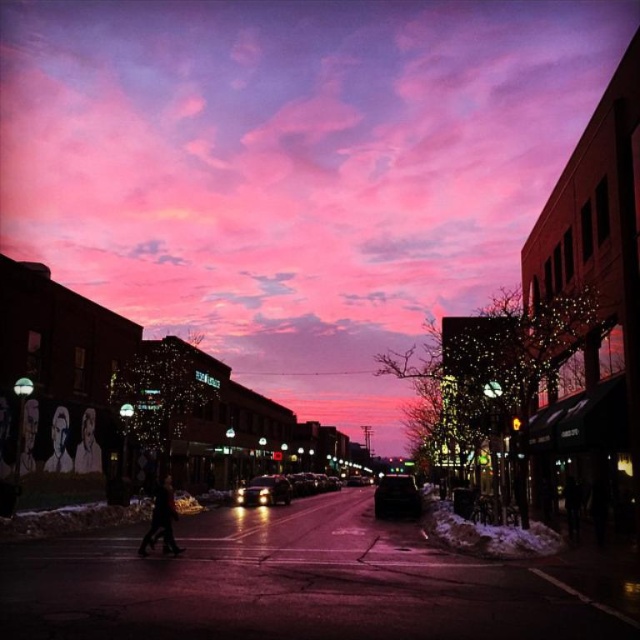
Question: Does pink matte sky at upper center have a lesser width compared to smooth skin portrait at lower left?

Choices:
 (A) no
 (B) yes

Answer: (A)

Question: Among these points, which one is nearest to the camera?

Choices:
 (A) (164, 490)
 (B) (236, 493)
 (C) (54, 465)
 (D) (403, 474)

Answer: (A)

Question: Is smooth white portrait at left below smooth skin figure at lower left?

Choices:
 (A) yes
 (B) no

Answer: (A)

Question: Which of the following is the farthest from the observer?

Choices:
 (A) (403, 509)
 (B) (20, 432)

Answer: (A)

Question: Based on their relative distances, which object is nearer to the pink matte sky at upper center?

Choices:
 (A) glossy black car at center
 (B) shiny silver sedan at center
 (C) smooth white portrait at left

Answer: (B)

Question: Does smooth skin portrait at lower left lie behind smooth white portrait at left?

Choices:
 (A) yes
 (B) no

Answer: (B)